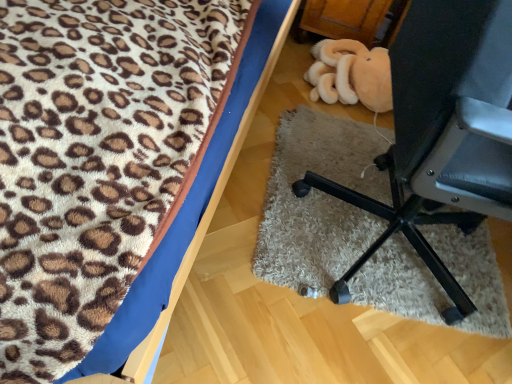
Measure the distance between point (39, 298) and camera.

They are 55.60 centimeters apart.

Identify the location of leopard print fabric at upper left, the second furniture in the right-to-left sequence. This screenshot has height=384, width=512. (106, 161).

What do you see at coordinates (106, 161) in the screenshot? The width and height of the screenshot is (512, 384). I see `leopard print fabric at upper left, the second furniture in the right-to-left sequence` at bounding box center [106, 161].

This screenshot has height=384, width=512. What do you see at coordinates (441, 134) in the screenshot?
I see `black plastic chair at lower right, arranged as the first furniture when viewed from the right` at bounding box center [441, 134].

At what (x,y) coordinates should I click in order to perform the action: click on black plastic chair at lower right, arranged as the first furniture when viewed from the right. Please return your answer as a coordinate pair (x, y). The height and width of the screenshot is (384, 512). Looking at the image, I should click on (441, 134).

How much space does black plastic chair at lower right, arranged as the first furniture when viewed from the right, occupy horizontally?

black plastic chair at lower right, arranged as the first furniture when viewed from the right, is 27.14 inches wide.

Identify the location of leopard print fabric at upper left, the second furniture in the right-to-left sequence. (106, 161).

Looking at this image, which is more to the right, black plastic chair at lower right, the second furniture positioned from the left, or leopard print fabric at upper left, the first furniture viewed from the left?

black plastic chair at lower right, the second furniture positioned from the left, is more to the right.

Considering their positions, is black plastic chair at lower right, the second furniture positioned from the left, located in front of or behind leopard print fabric at upper left, the second furniture in the right-to-left sequence?

black plastic chair at lower right, the second furniture positioned from the left, is behind leopard print fabric at upper left, the second furniture in the right-to-left sequence.

Considering the positions of point (466, 104) and point (137, 120), is point (466, 104) closer or farther from the camera than point (137, 120)?

Clearly, point (466, 104) is closer to the camera than point (137, 120).

From the image's perspective, relative to leopard print fabric at upper left, the first furniture viewed from the left, is black plastic chair at lower right, arranged as the first furniture when viewed from the right, above or below?

black plastic chair at lower right, arranged as the first furniture when viewed from the right, is below leopard print fabric at upper left, the first furniture viewed from the left.

From a real-world perspective, relative to leopard print fabric at upper left, the second furniture in the right-to-left sequence, is black plastic chair at lower right, the second furniture positioned from the left, vertically above or below?

black plastic chair at lower right, the second furniture positioned from the left, is above leopard print fabric at upper left, the second furniture in the right-to-left sequence.

Looking at their sizes, would you say black plastic chair at lower right, the second furniture positioned from the left, is wider or thinner than leopard print fabric at upper left, the first furniture viewed from the left?

In the image, black plastic chair at lower right, the second furniture positioned from the left, appears to be more narrow than leopard print fabric at upper left, the first furniture viewed from the left.

Considering the relative sizes of black plastic chair at lower right, the second furniture positioned from the left, and leopard print fabric at upper left, the first furniture viewed from the left, in the image provided, is black plastic chair at lower right, the second furniture positioned from the left, shorter than leopard print fabric at upper left, the first furniture viewed from the left,?

No.

Considering the sizes of objects black plastic chair at lower right, arranged as the first furniture when viewed from the right, and leopard print fabric at upper left, the second furniture in the right-to-left sequence, in the image provided, who is bigger, black plastic chair at lower right, arranged as the first furniture when viewed from the right, or leopard print fabric at upper left, the second furniture in the right-to-left sequence,?

leopard print fabric at upper left, the second furniture in the right-to-left sequence, is bigger.

Could leopard print fabric at upper left, the second furniture in the right-to-left sequence, be considered to be inside black plastic chair at lower right, the second furniture positioned from the left?

No, leopard print fabric at upper left, the second furniture in the right-to-left sequence, is not inside black plastic chair at lower right, the second furniture positioned from the left.

Is black plastic chair at lower right, the second furniture positioned from the left, touching leopard print fabric at upper left, the second furniture in the right-to-left sequence?

No, black plastic chair at lower right, the second furniture positioned from the left, is not in contact with leopard print fabric at upper left, the second furniture in the right-to-left sequence.

Looking at this image, does black plastic chair at lower right, the second furniture positioned from the left, turn towards leopard print fabric at upper left, the first furniture viewed from the left?

No, black plastic chair at lower right, the second furniture positioned from the left, is not turned towards leopard print fabric at upper left, the first furniture viewed from the left.

Locate an element on the screen. furniture on the right of leopard print fabric at upper left, the first furniture viewed from the left is located at coordinates (441, 134).

In the image, is leopard print fabric at upper left, the second furniture in the right-to-left sequence, on the left side or the right side of black plastic chair at lower right, arranged as the first furniture when viewed from the right?

Clearly, leopard print fabric at upper left, the second furniture in the right-to-left sequence, is on the left of black plastic chair at lower right, arranged as the first furniture when viewed from the right, in the image.

Between leopard print fabric at upper left, the second furniture in the right-to-left sequence, and black plastic chair at lower right, arranged as the first furniture when viewed from the right, which one is positioned in front?

leopard print fabric at upper left, the second furniture in the right-to-left sequence, is in front.

Looking at this image, which is closer, (93,179) or (484,118)?

Clearly, point (93,179) is closer to the camera than point (484,118).

From the image's perspective, does leopard print fabric at upper left, the second furniture in the right-to-left sequence, appear lower than black plastic chair at lower right, the second furniture positioned from the left?

Actually, leopard print fabric at upper left, the second furniture in the right-to-left sequence, appears above black plastic chair at lower right, the second furniture positioned from the left, in the image.

From a real-world perspective, does leopard print fabric at upper left, the first furniture viewed from the left, stand above black plastic chair at lower right, arranged as the first furniture when viewed from the right?

No, from a real-world perspective, leopard print fabric at upper left, the first furniture viewed from the left, is not above black plastic chair at lower right, arranged as the first furniture when viewed from the right.

Considering the relative sizes of leopard print fabric at upper left, the first furniture viewed from the left, and black plastic chair at lower right, arranged as the first furniture when viewed from the right, in the image provided, is leopard print fabric at upper left, the first furniture viewed from the left, wider than black plastic chair at lower right, arranged as the first furniture when viewed from the right,?

Correct, the width of leopard print fabric at upper left, the first furniture viewed from the left, exceeds that of black plastic chair at lower right, arranged as the first furniture when viewed from the right.

Can you confirm if leopard print fabric at upper left, the second furniture in the right-to-left sequence, is shorter than black plastic chair at lower right, the second furniture positioned from the left?

Indeed, leopard print fabric at upper left, the second furniture in the right-to-left sequence, has a lesser height compared to black plastic chair at lower right, the second furniture positioned from the left.

Can you confirm if leopard print fabric at upper left, the first furniture viewed from the left, is smaller than black plastic chair at lower right, the second furniture positioned from the left?

No.

Choose the correct answer: Is leopard print fabric at upper left, the first furniture viewed from the left, inside black plastic chair at lower right, arranged as the first furniture when viewed from the right, or outside it?

leopard print fabric at upper left, the first furniture viewed from the left, is outside black plastic chair at lower right, arranged as the first furniture when viewed from the right.

Is leopard print fabric at upper left, the first furniture viewed from the left, next to black plastic chair at lower right, arranged as the first furniture when viewed from the right?

leopard print fabric at upper left, the first furniture viewed from the left, and black plastic chair at lower right, arranged as the first furniture when viewed from the right, are clearly separated.

Is leopard print fabric at upper left, the second furniture in the right-to-left sequence, oriented away from black plastic chair at lower right, arranged as the first furniture when viewed from the right?

No.

What's the angular difference between leopard print fabric at upper left, the first furniture viewed from the left, and black plastic chair at lower right, the second furniture positioned from the left,'s facing directions?

leopard print fabric at upper left, the first furniture viewed from the left, and black plastic chair at lower right, the second furniture positioned from the left, are facing 91.7 degrees away from each other.

You are a GUI agent. You are given a task and a screenshot of the screen. Output one action in this format:
    pyautogui.click(x=<x>, y=<y>)
    Task: Click on the furniture above the leopard print fabric at upper left, the second furniture in the right-to-left sequence (from a real-world perspective)
    The height and width of the screenshot is (384, 512).
    Given the screenshot: What is the action you would take?
    pyautogui.click(x=441, y=134)

The height and width of the screenshot is (384, 512). In order to click on furniture that is on the right side of leopard print fabric at upper left, the first furniture viewed from the left in this screenshot , I will do `click(441, 134)`.

You are a GUI agent. You are given a task and a screenshot of the screen. Output one action in this format:
    pyautogui.click(x=<x>, y=<y>)
    Task: Click on the furniture in front of the black plastic chair at lower right, arranged as the first furniture when viewed from the right
    The height and width of the screenshot is (384, 512).
    Given the screenshot: What is the action you would take?
    pyautogui.click(x=106, y=161)